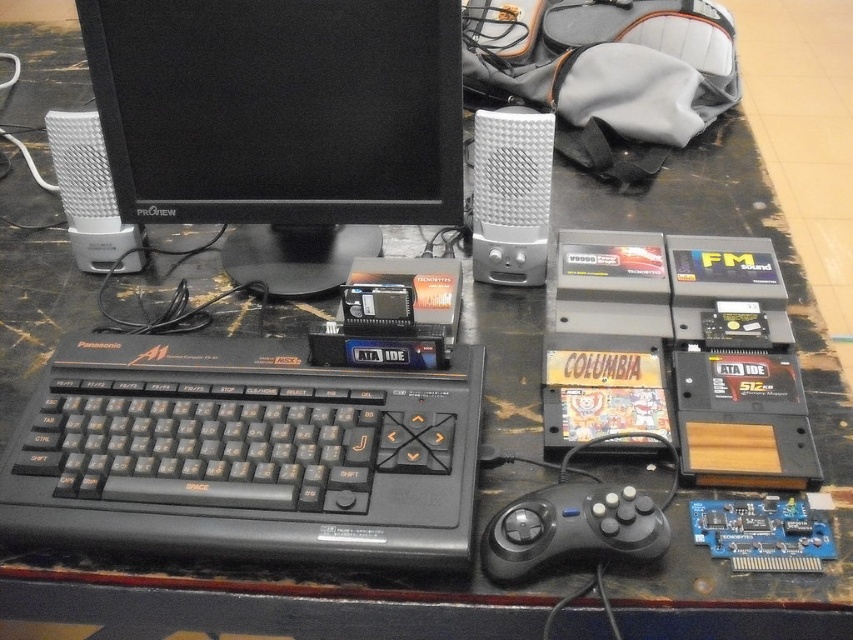
You are a technician standing 1 meter away from the table. You need to reach the black plastic keyboard at center to adjust its settings. Is the distance between you and the keyboard sufficient for you to comfortably reach it without moving closer?

The black plastic keyboard at center is 54.52 centimeters away from the viewer. Since you are standing 1 meter away, which is 100 centimeters, the distance is more than enough to comfortably reach the keyboard without moving closer.

You are a technician trying to reach a point on the table where a crucial component is located. The point is at coordinates point (161,145). If your hand can extend 25 inches, will you be able to reach it without moving your body?

The distance between point (161,145) and the camera is 30.15 inches. Since your hand can only extend 25 inches, you won not be able to reach the point without moving your body.

You are setting up a desk for a retro computing display. You have a black plastic computer at center and a black plastic keyboard at center. Which one should you place closer to the edge of the desk to ensure stability?

The black plastic computer at center is thinner than the black plastic keyboard at center, so placing the thinner black plastic computer at center closer to the edge might be less stable. The black plastic keyboard at center is thicker, so it would be more stable near the edge.